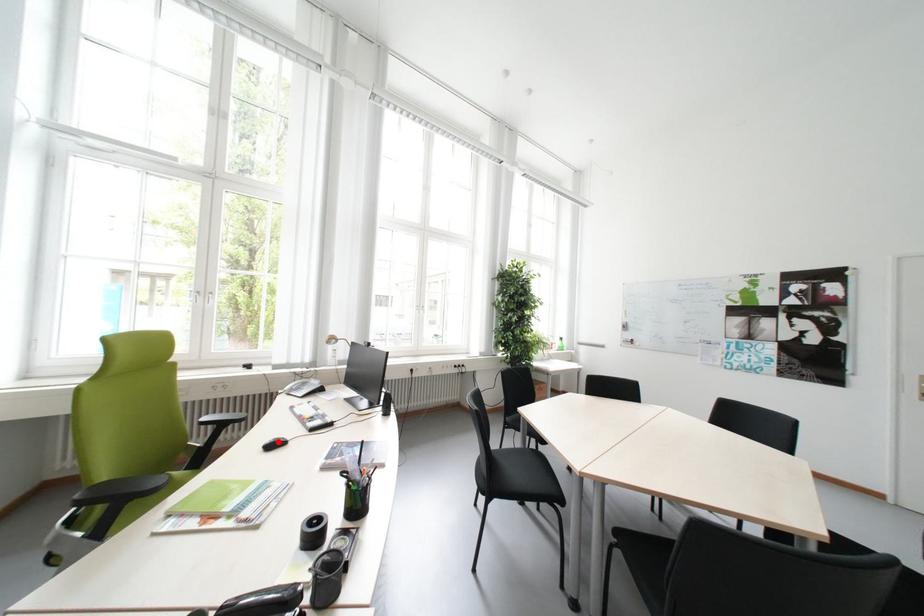
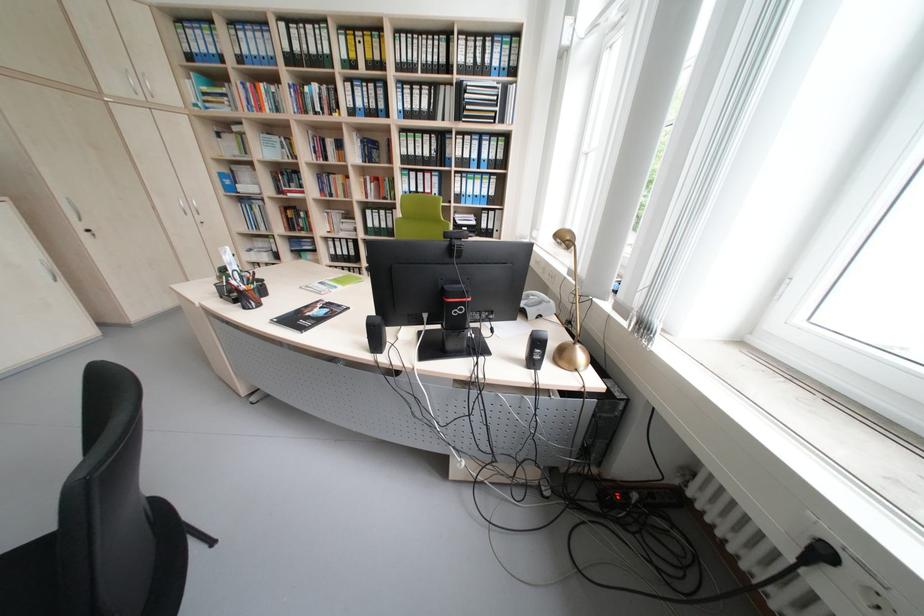
Question: I am providing you with two images of the same scene from different viewpoints. A red point is marked on the first image. Is the red point's position out of view in image 2?

Choices:
 (A) Yes
 (B) No

Answer: (A)